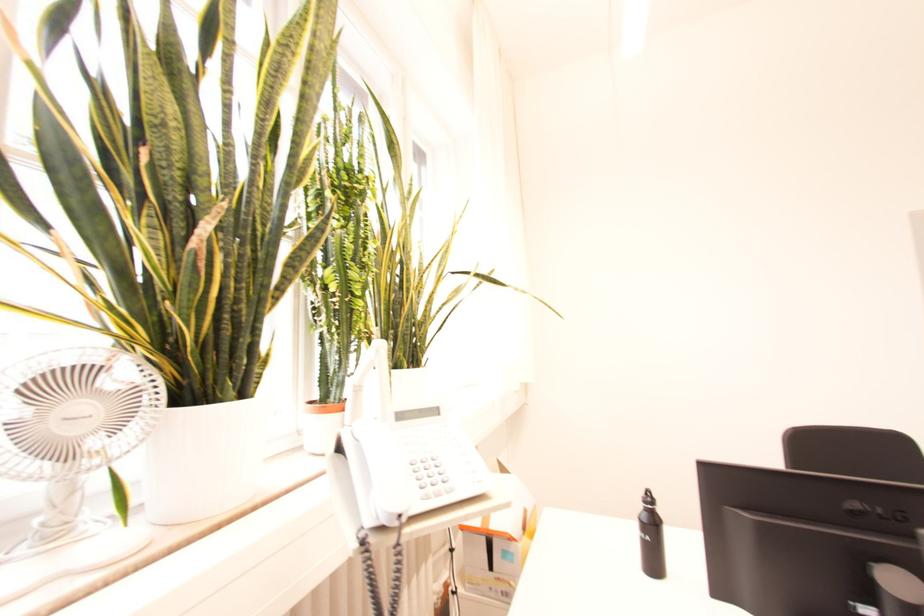
Describe the element at coordinates (648, 496) in the screenshot. I see `a black bottle cap` at that location.